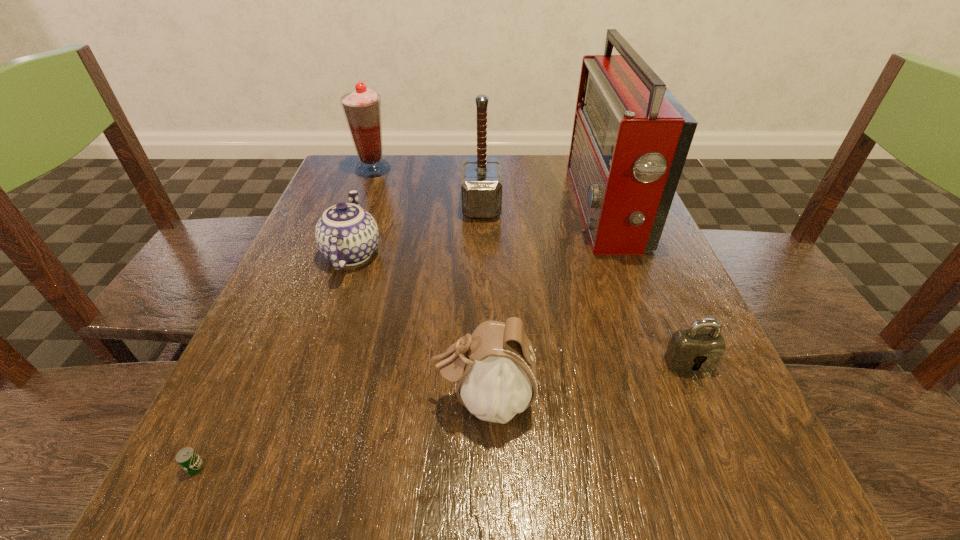
You are a GUI agent. You are given a task and a screenshot of the screen. Output one action in this format:
    pyautogui.click(x=<x>, y=<y>)
    Task: Click on the free location located 0.370m on the front-facing side of the radio receiver
    This screenshot has height=540, width=960.
    Given the screenshot: What is the action you would take?
    pyautogui.click(x=410, y=209)

Identify the location of free space located 0.300m on the front of the hammer. The height and width of the screenshot is (540, 960). (482, 327).

Locate an element on the screen. This screenshot has width=960, height=540. blank area located 0.370m on the front of the smoothie is located at coordinates (332, 278).

Locate an element on the screen. free space located 0.290m on the front-facing side of the fourth tallest object is located at coordinates (231, 400).

Identify the location of free spot located on the front-facing side of the fourth tallest object. The width and height of the screenshot is (960, 540). tap(350, 400).

Where is `vacant region located 0.200m on the front-facing side of the fourth tallest object`? vacant region located 0.200m on the front-facing side of the fourth tallest object is located at coordinates (295, 400).

Where is `vacant space located 0.250m at the spout of the chinaware`? The width and height of the screenshot is (960, 540). vacant space located 0.250m at the spout of the chinaware is located at coordinates (381, 168).

This screenshot has height=540, width=960. I want to click on vacant space located at the spout of the chinaware, so click(x=373, y=191).

This screenshot has height=540, width=960. Find the location of `free space located at the spout of the chinaware`. free space located at the spout of the chinaware is located at coordinates [x=375, y=187].

The height and width of the screenshot is (540, 960). In order to click on vacant area located at the front of the padlock near the keyhole in this screenshot , I will do `click(736, 474)`.